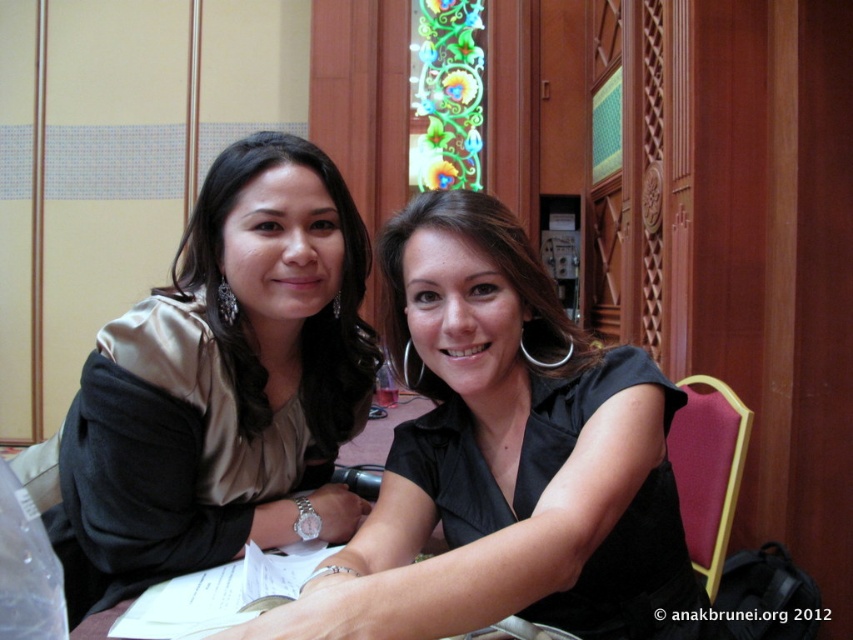
Is satin beige blouse at left below matte gold blouse at left?

Yes.

Is satin beige blouse at left to the right of matte gold blouse at left from the viewer's perspective?

In fact, satin beige blouse at left is to the left of matte gold blouse at left.

Measure the distance between point (355,522) and camera.

A distance of 5.87 feet exists between point (355,522) and camera.

This screenshot has height=640, width=853. Identify the location of satin beige blouse at left. (223, 385).

Does black matte shirt at center have a greater width compared to stained glass window at upper center?

No.

Is point (556, 316) closer to viewer compared to point (422, 115)?

Yes, it is.

Who is more distant from viewer, (495, 205) or (412, 33)?

Positioned behind is point (412, 33).

Locate an element on the screen. The image size is (853, 640). black matte shirt at center is located at coordinates (498, 272).

Does satin beige blouse at left come in front of black matte shirt at center?

No, satin beige blouse at left is further to the viewer.

The height and width of the screenshot is (640, 853). What do you see at coordinates (223, 385) in the screenshot?
I see `satin beige blouse at left` at bounding box center [223, 385].

Does point (212, 234) come farther from viewer compared to point (512, 288)?

Yes, point (212, 234) is farther from viewer.

Locate an element on the screen. This screenshot has height=640, width=853. satin beige blouse at left is located at coordinates (223, 385).